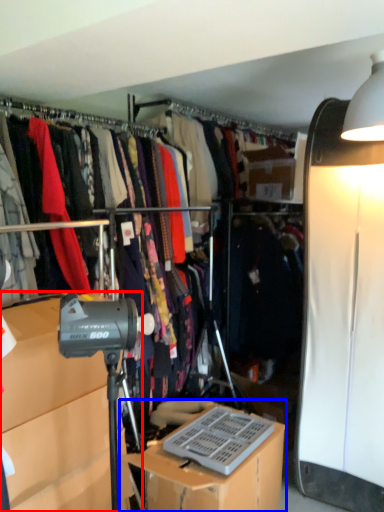
Question: Which of the following is the farthest to the observer, cabinetry (highlighted by a red box) or desk (highlighted by a blue box)?

Choices:
 (A) cabinetry
 (B) desk

Answer: (B)